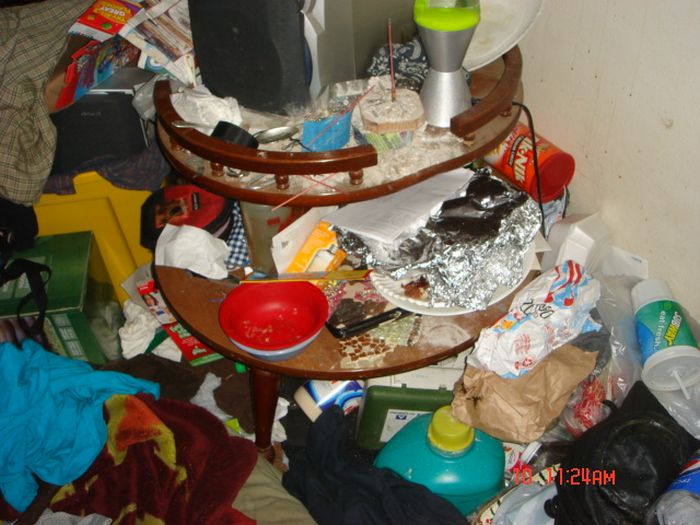
I want to click on table leg, so click(258, 401).